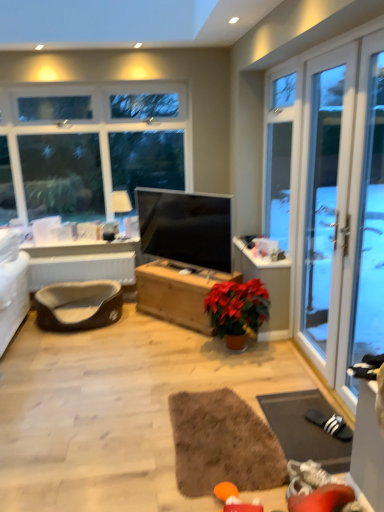
Locate an element on the screen. This screenshot has width=384, height=512. vacant area situated below dark gray rubber yoga mat at lower right, the first yoga mat viewed from the right (from a real-world perspective) is located at coordinates (303, 428).